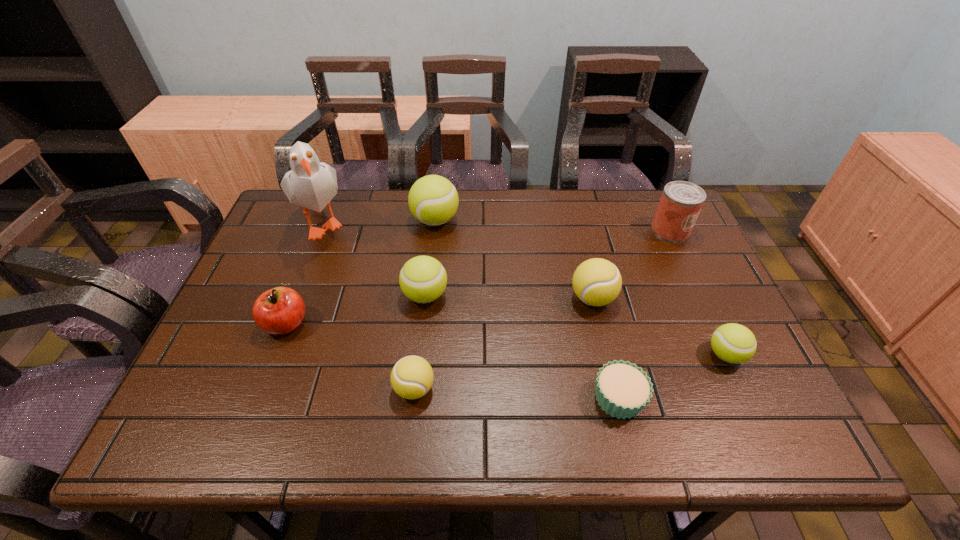
The width and height of the screenshot is (960, 540). I want to click on object that is at the far left corner, so click(312, 184).

This screenshot has height=540, width=960. I want to click on object situated at the far right corner, so click(x=681, y=202).

The image size is (960, 540). In the image, there is a desktop. What are the coordinates of `vacant region at the far edge` in the screenshot? It's located at (546, 194).

The width and height of the screenshot is (960, 540). In the image, there is a desktop. Identify the location of vacant region at the near edge. (375, 418).

The image size is (960, 540). Identify the location of free space at the left edge of the desktop. (267, 260).

The height and width of the screenshot is (540, 960). In order to click on vacant point at the far left corner in this screenshot , I will do `click(280, 227)`.

Find the location of `free space at the far right corner of the desktop`. free space at the far right corner of the desktop is located at coordinates (632, 197).

Locate an element on the screen. free space between the can and the shortest object is located at coordinates (644, 314).

Locate an element on the screen. The width and height of the screenshot is (960, 540). unoccupied position between the biggest green tennis ball and the farther yellow tennis ball is located at coordinates (514, 259).

Where is `empty space between the nearer yellow tennis ball and the can`? The image size is (960, 540). empty space between the nearer yellow tennis ball and the can is located at coordinates (542, 309).